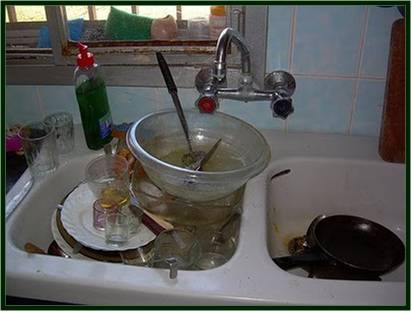
Find the location of a particular element. The height and width of the screenshot is (312, 412). soap is located at coordinates (100, 103).